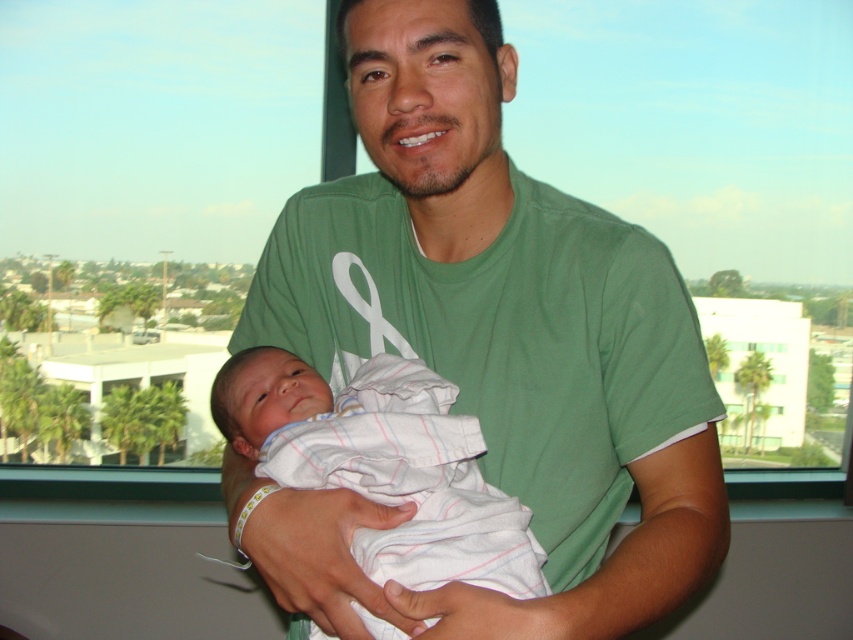
You are a photographer setting up a shoot in the room. You need to place a small lamp to the left of the white striped cloth at center. Will the lamp also be to the left of the green cotton shirt at center?

The green cotton shirt at center is to the right of the white striped cloth at center. Since the lamp is placed to the left of the white striped cloth at center, it will also be to the left of the green cotton shirt at center.

You are a photographer setting up a shot of the man and baby. The green cotton shirt at center is at coordinates point (x=489, y=346). If you want to focus on the green cotton shirt at center, where should you aim your camera?

The green cotton shirt at center is located at point (x=489, y=346), so aim your camera at those coordinates to focus on it.

What is the exact coordinate of the green cotton shirt at center?

The green cotton shirt at center is located at point [489,346].